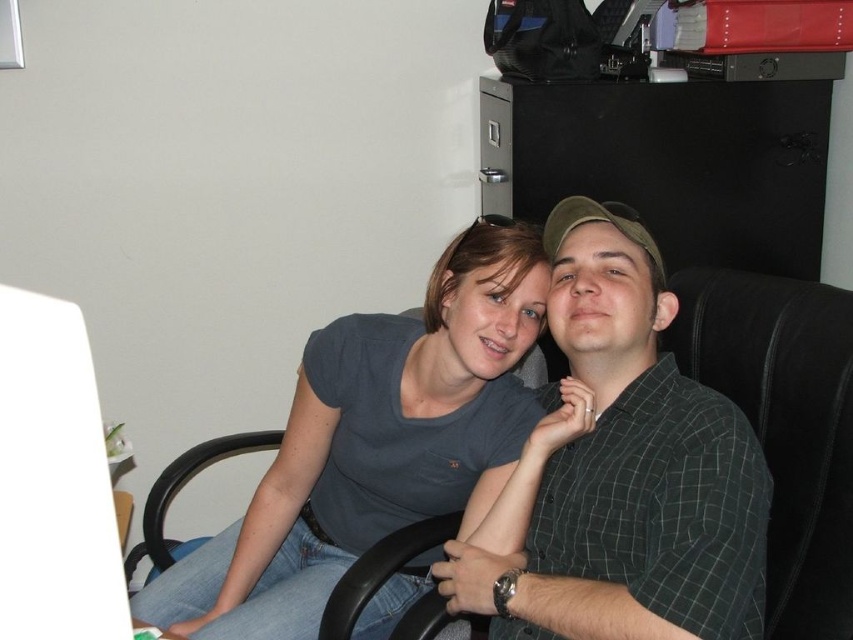
Is point (503, 461) positioned in front of point (705, 465)?

No, it is not.

Is gray matte t-shirt at center behind green checkered shirt at center?

That is True.

Does point (492, 266) come in front of point (706, 593)?

No, it is behind (706, 593).

Where is `gray matte t-shirt at center`? gray matte t-shirt at center is located at coordinates (375, 444).

Is green checkered shirt at center wider than black leather computer chair at center?

Incorrect, green checkered shirt at center's width does not surpass black leather computer chair at center's.

Which is behind, point (635, 275) or point (224, 440)?

Positioned behind is point (224, 440).

Identify the location of green checkered shirt at center. (628, 472).

Between point (160, 579) and point (279, 600), which one is positioned in front?

Point (279, 600)

Is point (514, 248) positioned in front of point (383, 612)?

Yes, point (514, 248) is closer to viewer.

Locate an element on the screen. This screenshot has height=640, width=853. gray matte t-shirt at center is located at coordinates (375, 444).